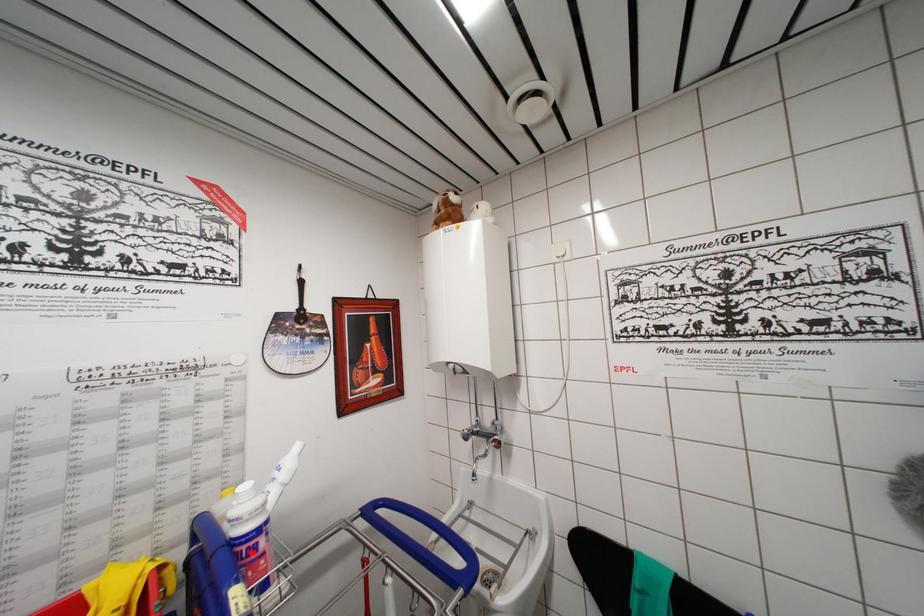
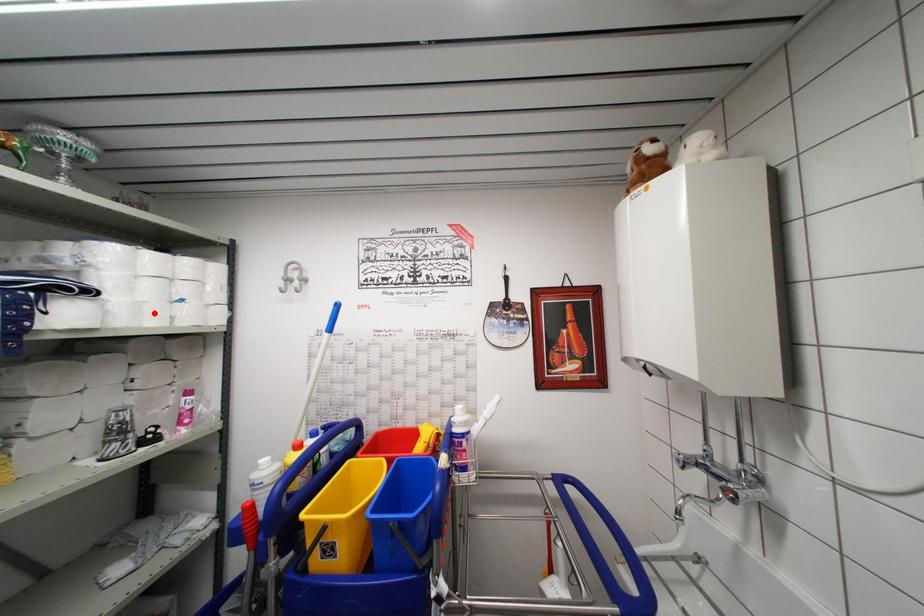
I am providing you with two images of the same scene from different viewpoints. A red point is marked on the first image and another point is marked on the second image. Do the highlighted points in image1 and image2 indicate the same real-world spot?

No